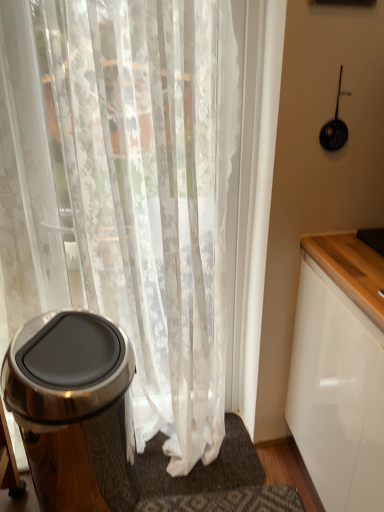
Measure the distance between point (97, 355) and camera.

Point (97, 355) is 4.17 feet from camera.

Identify the location of white sheer curtain at left. The width and height of the screenshot is (384, 512). (125, 190).

Can you tell me how much white sheer curtain at left and polished stainless steel trash can at left differ in facing direction?

The angular difference between white sheer curtain at left and polished stainless steel trash can at left is 4.61 degrees.

Considering their positions, is white sheer curtain at left located in front of or behind polished stainless steel trash can at left?

Visually, white sheer curtain at left is located in front of polished stainless steel trash can at left.

From the image's perspective, which object appears higher, white sheer curtain at left or polished stainless steel trash can at left?

white sheer curtain at left is shown above in the image.

Are white sheer curtain at left and polished stainless steel trash can at left far apart?

Actually, white sheer curtain at left and polished stainless steel trash can at left are a little close together.

Locate an element on the screen. This screenshot has height=512, width=384. waste container behind the white sheer curtain at left is located at coordinates (72, 407).

Looking at this image, who is bigger, polished stainless steel trash can at left or white sheer curtain at left?

With larger size is white sheer curtain at left.

Does polished stainless steel trash can at left come behind white sheer curtain at left?

Yes, it is.

How different are the orientations of polished stainless steel trash can at left and white sheer curtain at left in degrees?

4.61 degrees.

Is polished stainless steel trash can at left at the back of white textured bath mat at lower center?

white textured bath mat at lower center is not turned away from polished stainless steel trash can at left.

Does white textured bath mat at lower center have a lesser width compared to polished stainless steel trash can at left?

Indeed, white textured bath mat at lower center has a lesser width compared to polished stainless steel trash can at left.

Is white textured bath mat at lower center not inside polished stainless steel trash can at left?

Indeed, white textured bath mat at lower center is completely outside polished stainless steel trash can at left.

In the image, is white textured bath mat at lower center on the left side or the right side of white sheer curtain at left?

Clearly, white textured bath mat at lower center is on the right of white sheer curtain at left in the image.

Which is nearer, (258, 474) or (218, 72)?

Point (258, 474) is positioned farther from the camera compared to point (218, 72).

Relative to white sheer curtain at left, is white textured bath mat at lower center in front or behind?

white textured bath mat at lower center is positioned farther from the viewer than white sheer curtain at left.

Considering the sizes of objects white textured bath mat at lower center and white sheer curtain at left in the image provided, who is smaller, white textured bath mat at lower center or white sheer curtain at left?

Smaller between the two is white textured bath mat at lower center.

Is white sheer curtain at left oriented away from white textured bath mat at lower center?

white sheer curtain at left is not turned away from white textured bath mat at lower center.

Is point (56, 59) closer or farther from the camera than point (140, 494)?

Point (56, 59) is positioned closer to the camera compared to point (140, 494).

In order to click on curtain on the left of white textured bath mat at lower center in this screenshot , I will do `click(125, 190)`.

Is white sheer curtain at left bigger than white textured bath mat at lower center?

Yes, white sheer curtain at left is bigger than white textured bath mat at lower center.

Find the location of `waste container positioned vertically above the white textured bath mat at lower center (from a real-world perspective)`. waste container positioned vertically above the white textured bath mat at lower center (from a real-world perspective) is located at coordinates (72, 407).

Which of these two, polished stainless steel trash can at left or white textured bath mat at lower center, is bigger?

polished stainless steel trash can at left.

Between polished stainless steel trash can at left and white textured bath mat at lower center, which one has smaller width?

white textured bath mat at lower center.

Is polished stainless steel trash can at left positioned with its back to white textured bath mat at lower center?

No, polished stainless steel trash can at left's orientation is not away from white textured bath mat at lower center.

This screenshot has width=384, height=512. What are the coordinates of `waste container that appears on the left of white sheer curtain at left` in the screenshot? It's located at [x=72, y=407].

At what (x,y) coordinates should I click in order to perform the action: click on curtain on the right of polished stainless steel trash can at left. Please return your answer as a coordinate pair (x, y). This screenshot has height=512, width=384. Looking at the image, I should click on (125, 190).

Looking at the image, which one is located closer to white textured bath mat at lower center, white sheer curtain at left or polished stainless steel trash can at left?

polished stainless steel trash can at left is closer to white textured bath mat at lower center.

Looking at the image, which one is located further to white sheer curtain at left, polished stainless steel trash can at left or white textured bath mat at lower center?

white textured bath mat at lower center is further to white sheer curtain at left.

Which object lies nearer to the anchor point polished stainless steel trash can at left, white sheer curtain at left or white textured bath mat at lower center?

white sheer curtain at left.

Which object lies further to the anchor point polished stainless steel trash can at left, white textured bath mat at lower center or white sheer curtain at left?

white textured bath mat at lower center is further to polished stainless steel trash can at left.

Estimate the real-world distances between objects in this image. Which object is further from white textured bath mat at lower center, polished stainless steel trash can at left or white sheer curtain at left?

white sheer curtain at left.

Looking at the image, which one is located further to white sheer curtain at left, white textured bath mat at lower center or polished stainless steel trash can at left?

Among the two, white textured bath mat at lower center is located further to white sheer curtain at left.

The height and width of the screenshot is (512, 384). I want to click on waste container between white sheer curtain at left and white textured bath mat at lower center vertically, so click(72, 407).